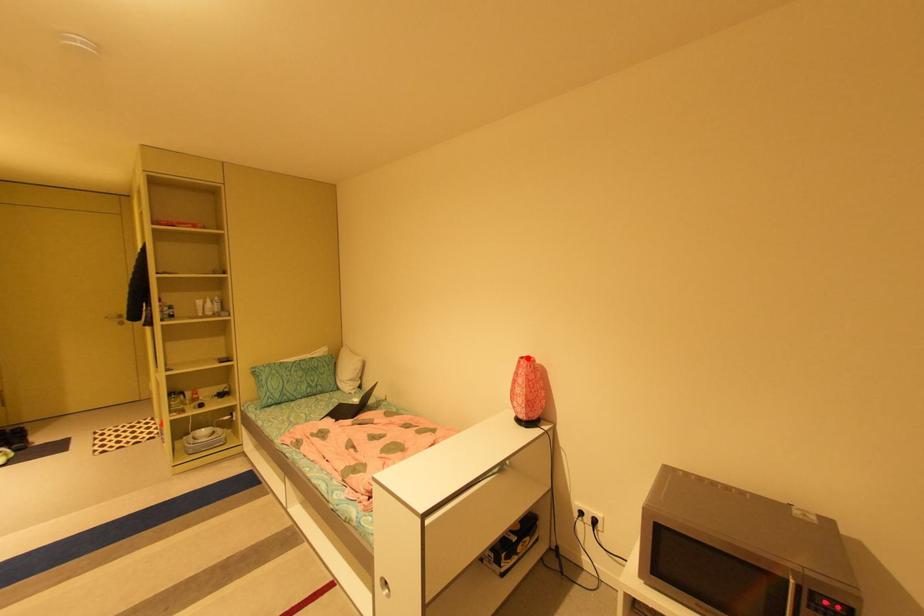
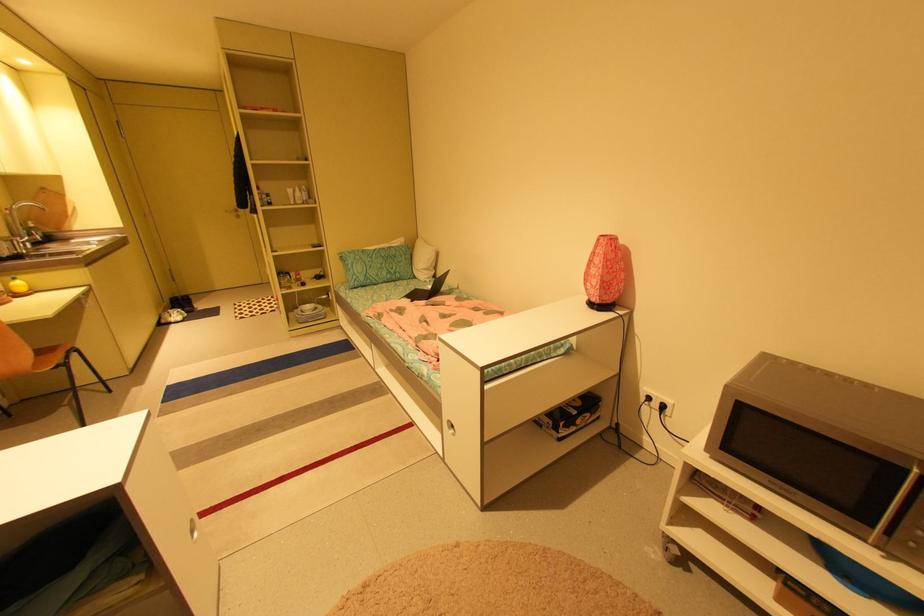
Where in the second image is the point corresponding to the highlighted location from the first image?

(608, 236)